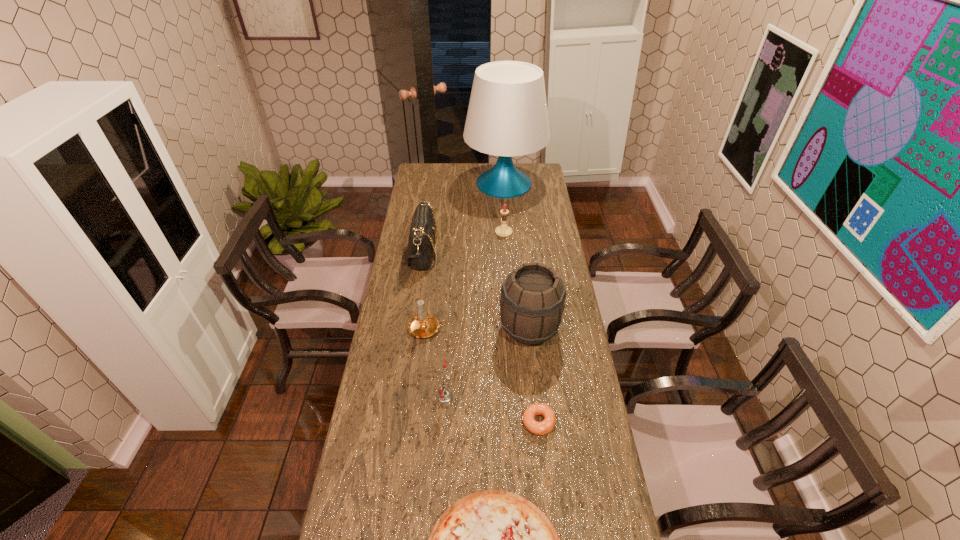
I want to click on free space located at the front of the handbag with chain and zipper, so click(x=471, y=252).

This screenshot has height=540, width=960. Find the location of `free location located on the left of the rightmost candle`. free location located on the left of the rightmost candle is located at coordinates (420, 232).

Locate an element on the screen. This screenshot has width=960, height=540. vacant space situated 0.130m on the right of the second nearest candle is located at coordinates (481, 329).

Where is `blank space located 0.240m on the front-facing side of the nearest candle`? blank space located 0.240m on the front-facing side of the nearest candle is located at coordinates (525, 396).

In order to click on vacant space located 0.060m on the front of the doughnut in this screenshot , I will do `click(542, 457)`.

I want to click on object that is at the far edge, so click(507, 116).

This screenshot has height=540, width=960. In order to click on handbag located at the left edge in this screenshot , I will do `click(421, 245)`.

You are a GUI agent. You are given a task and a screenshot of the screen. Output one action in this format:
    pyautogui.click(x=<x>, y=<y>)
    Task: Click on the candle at the left edge
    This screenshot has height=540, width=960.
    Given the screenshot: What is the action you would take?
    pyautogui.click(x=423, y=325)

Where is `table lamp that is positioned at the right edge`? table lamp that is positioned at the right edge is located at coordinates (507, 116).

The width and height of the screenshot is (960, 540). I want to click on wine bucket at the right edge, so click(532, 302).